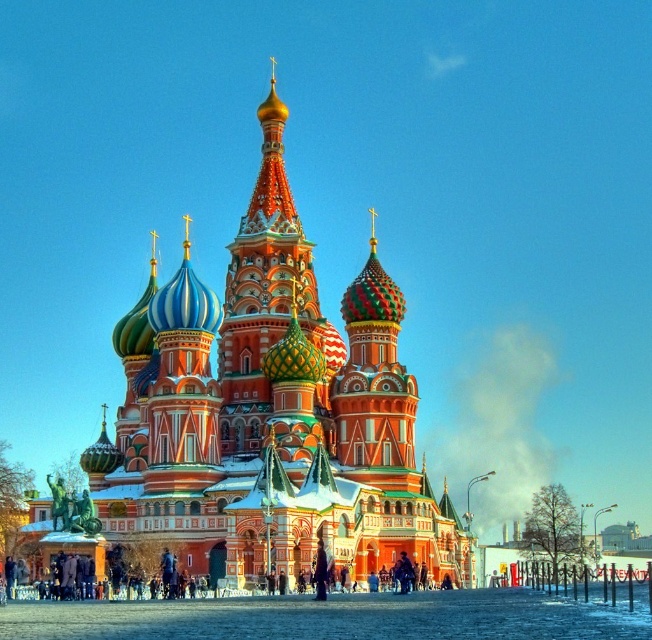
Is polychrome mosaic church at center positioned behind polychrome mosaic dome at center?

That is False.

Which is below, polychrome mosaic church at center or polychrome mosaic dome at center?

polychrome mosaic church at center

The width and height of the screenshot is (652, 640). Identify the location of polychrome mosaic church at center. click(x=269, y=412).